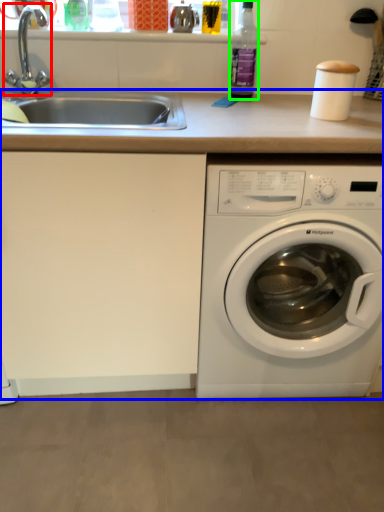
Question: Which is nearer to the faucet (highlighted by a red box)? counter top (highlighted by a blue box) or bottle (highlighted by a green box).

Choices:
 (A) counter top
 (B) bottle

Answer: (B)